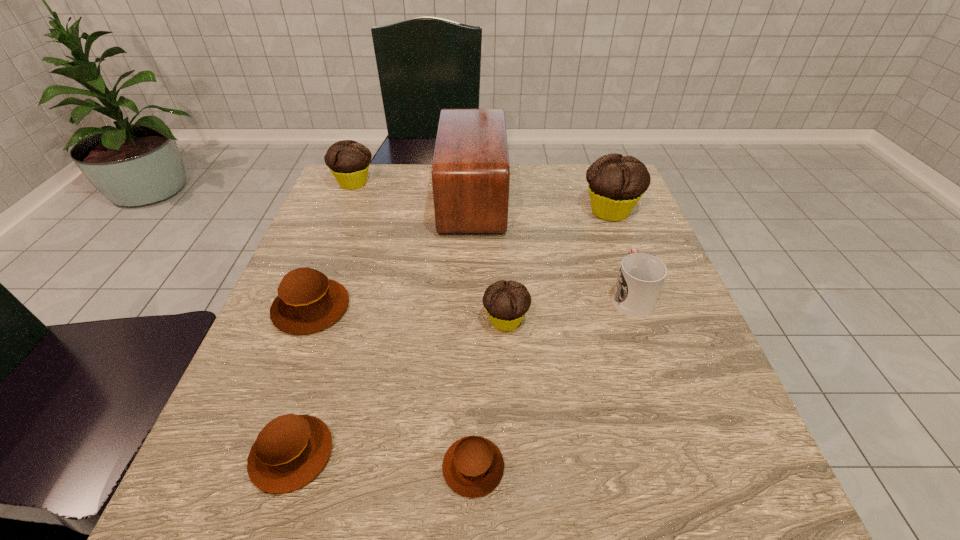
Find the location of a particular element. This screenshot has height=540, width=960. the tallest object is located at coordinates (470, 170).

Image resolution: width=960 pixels, height=540 pixels. Identify the location of the second farthest chocolate muffin. (616, 183).

Where is `the seventh shortest object`? The height and width of the screenshot is (540, 960). the seventh shortest object is located at coordinates (616, 183).

The height and width of the screenshot is (540, 960). Find the location of `the farthest chocolate muffin`. the farthest chocolate muffin is located at coordinates click(348, 160).

This screenshot has height=540, width=960. Identify the location of the second biggest chocolate muffin. (348, 160).

Locate an element on the screen. red cup is located at coordinates (641, 276).

Locate an element on the screen. the farthest brown muffin is located at coordinates (307, 302).

At what (x,y) coordinates should I click in order to perform the action: click on the nearest chocolate muffin. Please return your answer as a coordinate pair (x, y). The image size is (960, 540). Looking at the image, I should click on coord(506,302).

Find the location of a particular element. Image resolution: width=960 pixels, height=540 pixels. the smallest chocolate muffin is located at coordinates (506, 302).

Identify the location of the second shortest object. (290, 451).